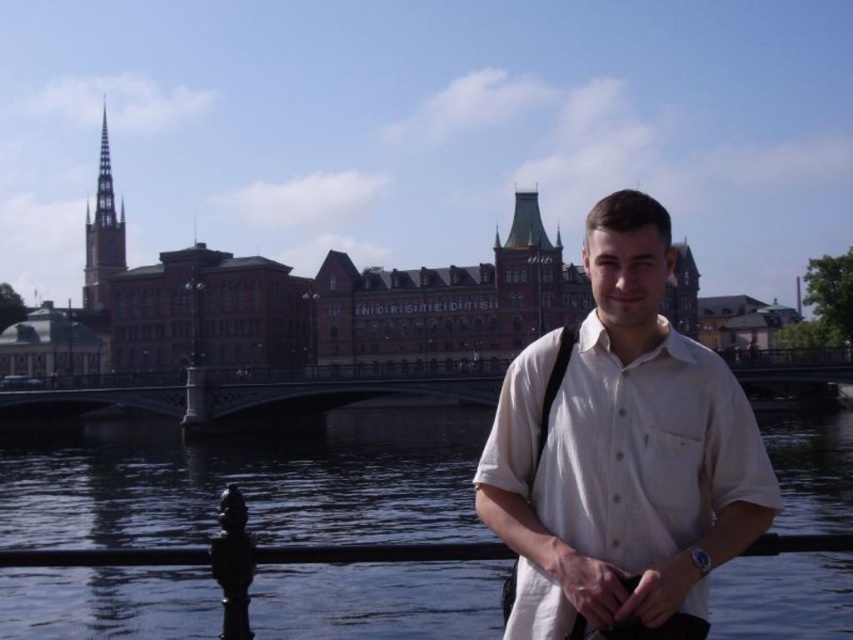
You are a photographer trying to capture the man and the bridge in the background. To ensure the transparent glass water at center is in focus, where should you adjust your camera focus? Specify the coordinates provided in the description.

The transparent glass water at center is at point (248, 483), so you should adjust your camera focus to that coordinate to ensure it is in focus.

You are standing at the point marked as point (x=248, y=483) in the image. What is the material of the surface you are currently standing on?

The surface at point (x=248, y=483) is transparent glass water at center.

You are standing at the riverside and want to toss the object you are holding into the transparent glass water at center. Considering the distance, can you accurately throw it from where you are standing?

The distance between you and the transparent glass water at center is 72.28 meters, which is quite far. It would be challenging to accurately throw an object that distance unless you have exceptional throwing ability.